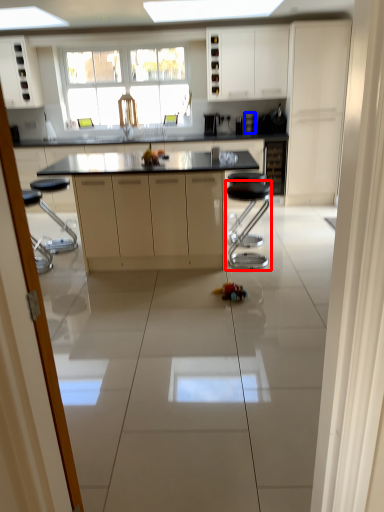
Question: Which object is closer to the camera taking this photo, bar stool (highlighted by a red box) or appliance (highlighted by a blue box)?

Choices:
 (A) bar stool
 (B) appliance

Answer: (A)